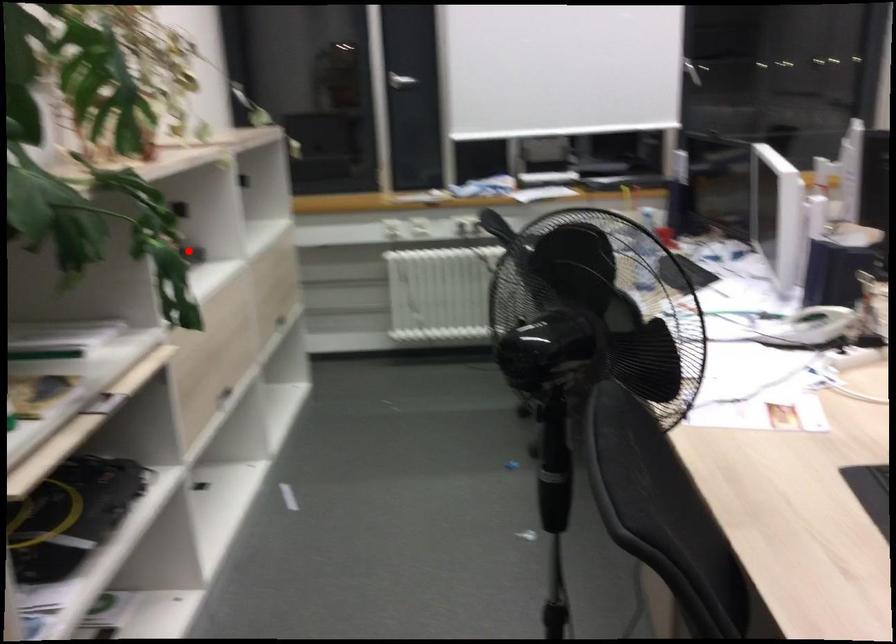
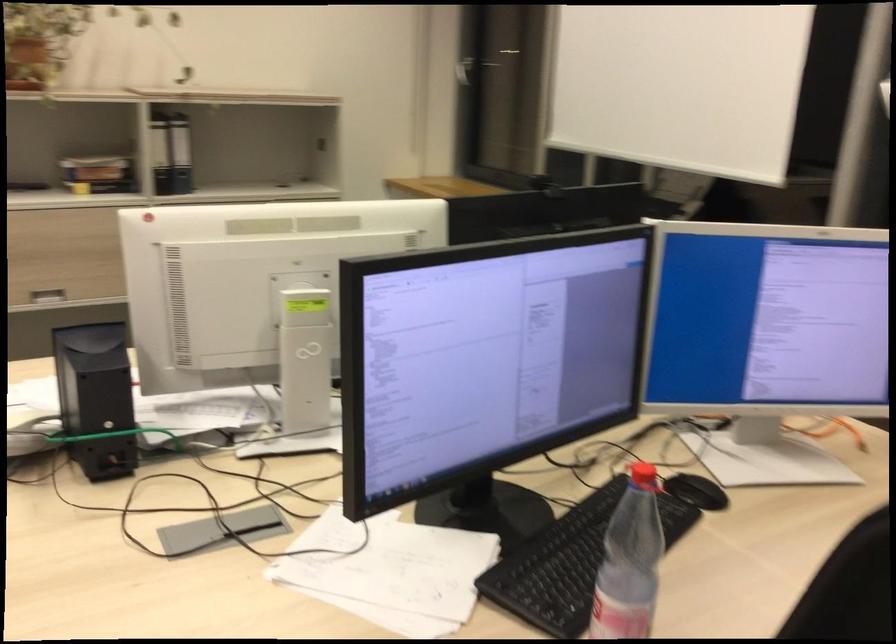
Question: I am providing you with two images of the same scene from different viewpoints. Image1 has a red point marked. In image2, the corresponding 3D location appears at what relative position? Reply with the corresponding letter.

Choices:
 (A) Closer
 (B) Farther

Answer: (B)